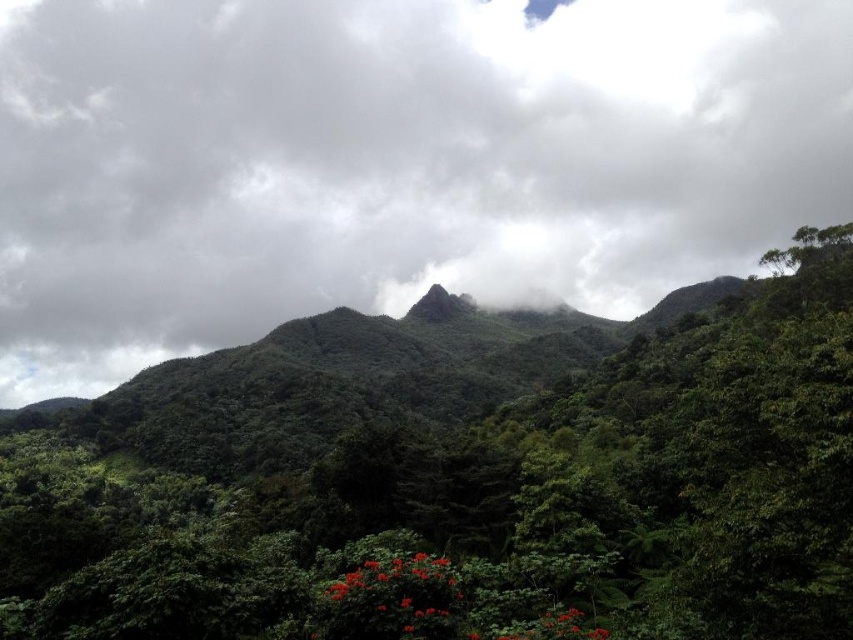
Looking at this image, you are standing in the lush mountainous landscape described. If you look directly ahead, what do you see at the point marked by the coordinates point (392, 161)?

At the coordinates point (392, 161), you see cloudy sky at center.

You are standing in the mountain landscape and want to take a photo of both the cloudy sky at center and the green leafy tree at center. Which object will appear closer to you in the photo?

The cloudy sky at center will appear closer to you in the photo because it is further to the viewer than the green leafy tree at center.

You are standing in the middle of the mountain landscape and looking up. Which object is higher up in the sky between the cloudy sky at center and the green leafy tree at center?

The cloudy sky at center is higher up in the sky than the green leafy tree at center because it is positioned above it.